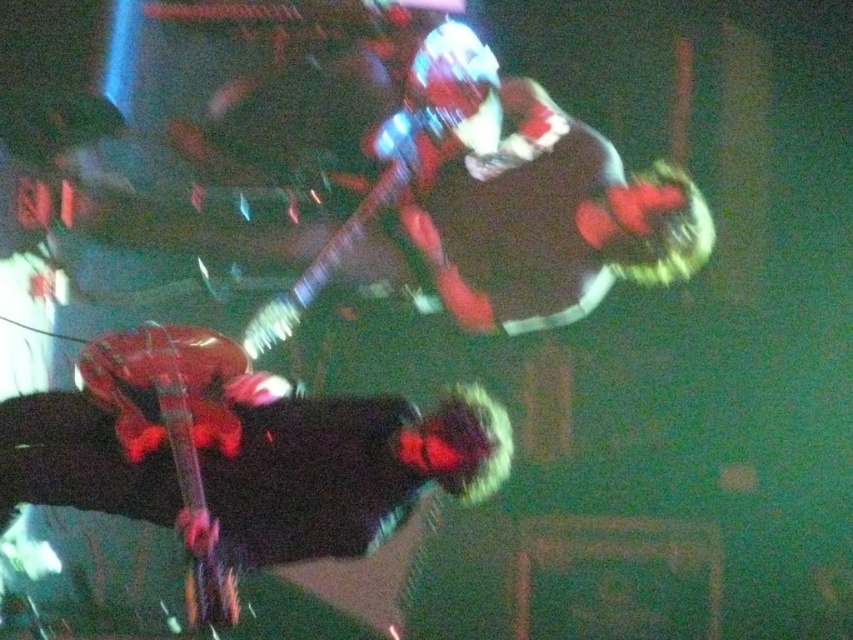
Question: Does shiny black guitar at lower left have a greater width compared to glossy electric guitar at upper center?

Choices:
 (A) no
 (B) yes

Answer: (B)

Question: Does shiny black guitar at lower left come in front of glossy red guitar at lower left?

Choices:
 (A) yes
 (B) no

Answer: (B)

Question: Which object is the farthest from the shiny black guitar at lower left?

Choices:
 (A) glossy red guitar at lower left
 (B) glossy electric guitar at upper center

Answer: (B)

Question: Which object appears closest to the camera in this image?

Choices:
 (A) shiny black guitar at lower left
 (B) glossy red guitar at lower left
 (C) glossy electric guitar at upper center

Answer: (B)

Question: Which of the following is the farthest from the observer?

Choices:
 (A) (61, 456)
 (B) (425, 51)
 (C) (201, 339)

Answer: (B)

Question: Does glossy red guitar at lower left appear on the right side of glossy electric guitar at upper center?

Choices:
 (A) yes
 (B) no

Answer: (B)